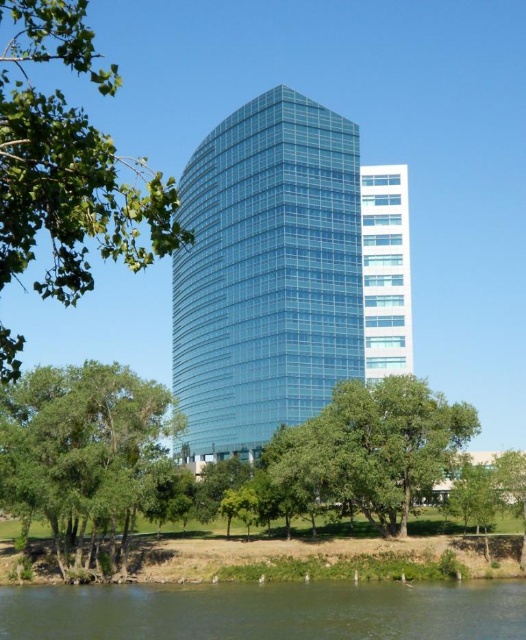
Question: Does green leafy tree at center appear on the left side of white glass building at center?

Choices:
 (A) no
 (B) yes

Answer: (B)

Question: Among these points, which one is farthest from the camera?

Choices:
 (A) (328, 628)
 (B) (74, 300)
 (C) (75, 369)

Answer: (C)

Question: Is green water at lower left below green leafy tree at lower left?

Choices:
 (A) no
 (B) yes

Answer: (B)

Question: Does green leafy tree at left appear under green leafy tree at lower right?

Choices:
 (A) no
 (B) yes

Answer: (A)

Question: Which object is farther from the camera taking this photo?

Choices:
 (A) green leafy tree at left
 (B) green water at lower left
 (C) transparent glass tower at center
 (D) white glass building at center

Answer: (D)

Question: Which object appears farthest from the camera in this image?

Choices:
 (A) green water at lower left
 (B) green leafy tree at center
 (C) green leafy tree at lower right

Answer: (B)